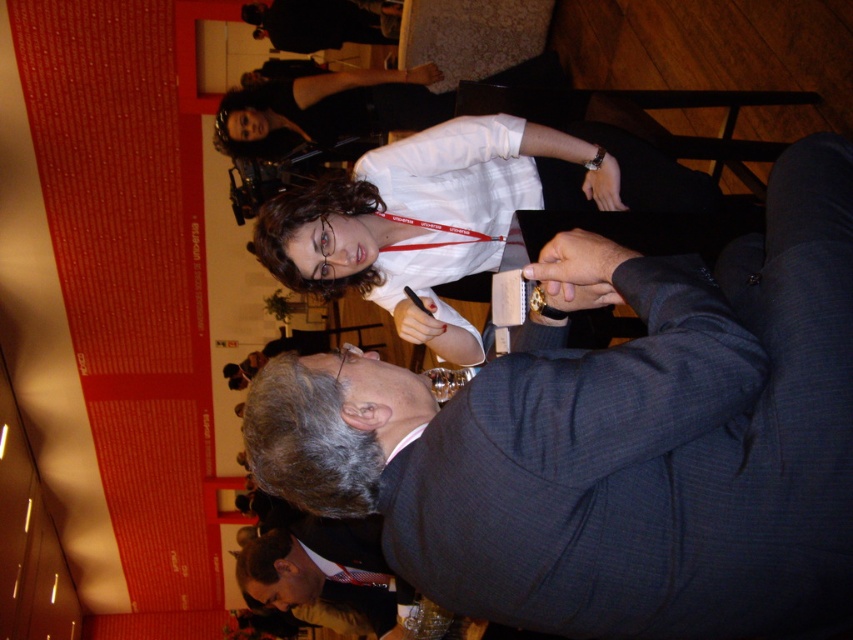
Is point (498, 163) in front of point (390, 593)?

Yes, it is in front of point (390, 593).

From the picture: Is white shirt at center above dark gray suit at lower center?

Yes, white shirt at center is above dark gray suit at lower center.

Describe the element at coordinates (454, 212) in the screenshot. I see `white shirt at center` at that location.

Find the location of a particular element. white shirt at center is located at coordinates (454, 212).

Is dark blue suit at center shorter than dark gray suit at lower center?

No, dark blue suit at center is not shorter than dark gray suit at lower center.

Between dark blue suit at center and dark gray suit at lower center, which one appears on the right side from the viewer's perspective?

dark blue suit at center is more to the right.

Between point (780, 317) and point (254, 547), which one is positioned in front?

Point (780, 317) is more forward.

Identify the location of dark blue suit at center. (614, 440).

Which is below, dark blue suit at center or white shirt at center?

dark blue suit at center

Is the position of dark blue suit at center less distant than that of white shirt at center?

That is True.

Between point (274, 394) and point (573, 198), which one is positioned behind?

Positioned behind is point (573, 198).

The height and width of the screenshot is (640, 853). In order to click on dark blue suit at center in this screenshot , I will do `click(614, 440)`.